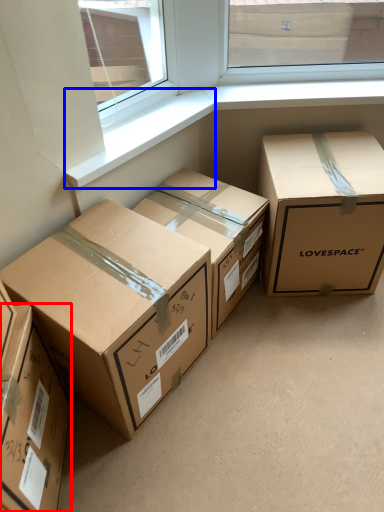
Question: Which object appears farthest to the camera in this image, box (highlighted by a red box) or window sill (highlighted by a blue box)?

Choices:
 (A) box
 (B) window sill

Answer: (B)